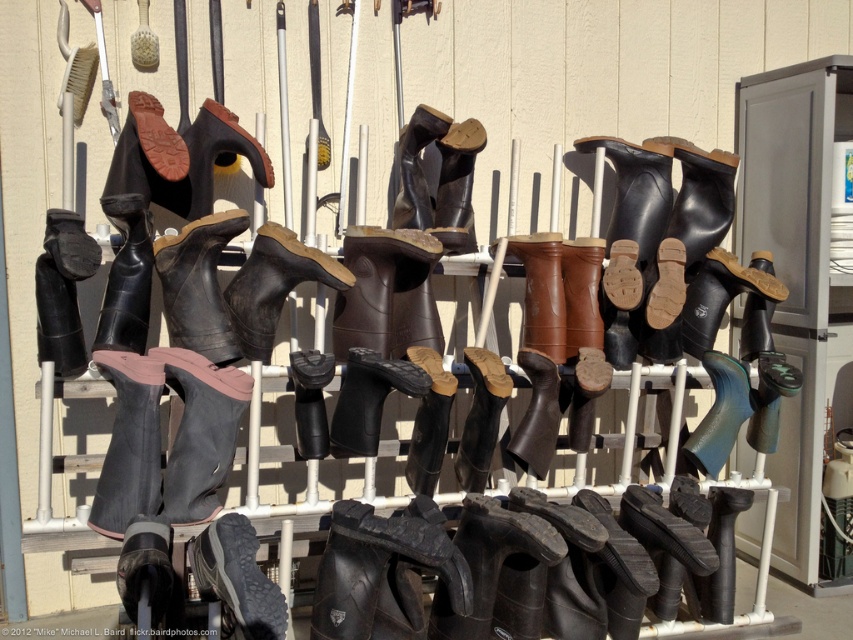
Question: Which object appears farthest from the camera in this image?

Choices:
 (A) black rubber boot at center
 (B) brown matte boot at upper left
 (C) rubber/matte boot at center

Answer: (C)

Question: Is shiny black boot at lower left thinner than brown matte boot at upper left?

Choices:
 (A) no
 (B) yes

Answer: (B)

Question: Which of the following is the closest to the observer?

Choices:
 (A) rubber/matte boot at center
 (B) shiny black boot at lower left
 (C) black rubber boot at center

Answer: (B)

Question: Is gray rubber shoe at lower center to the left of black rubber boot at center from the viewer's perspective?

Choices:
 (A) yes
 (B) no

Answer: (A)

Question: Which of these objects is positioned farthest from the rubber/matte boot at center?

Choices:
 (A) black rubber boot at center
 (B) brown matte boot at upper left
 (C) gray rubber shoe at lower center

Answer: (C)

Question: Considering the relative positions of shiny black boot at lower left and brown matte boot at upper left in the image provided, where is shiny black boot at lower left located with respect to brown matte boot at upper left?

Choices:
 (A) right
 (B) left

Answer: (A)